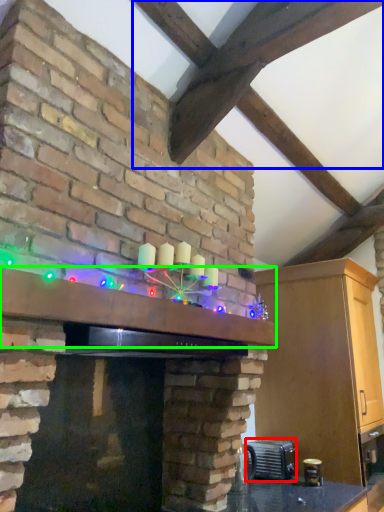
Question: Which object is positioned farthest from appliance (highlighted by a red box)? Select from exhaust hood (highlighted by a blue box) and mantle (highlighted by a green box).

Choices:
 (A) exhaust hood
 (B) mantle

Answer: (A)